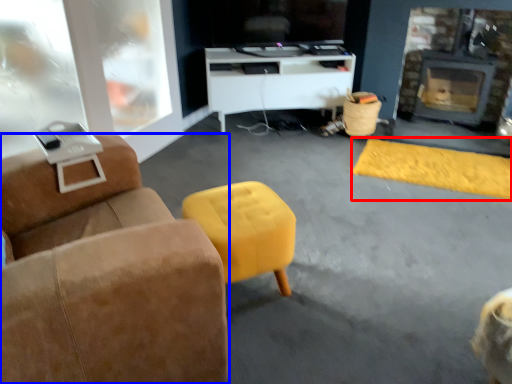
Question: Which of the following is the farthest to the observer, flat (highlighted by a red box) or furniture (highlighted by a blue box)?

Choices:
 (A) flat
 (B) furniture

Answer: (A)